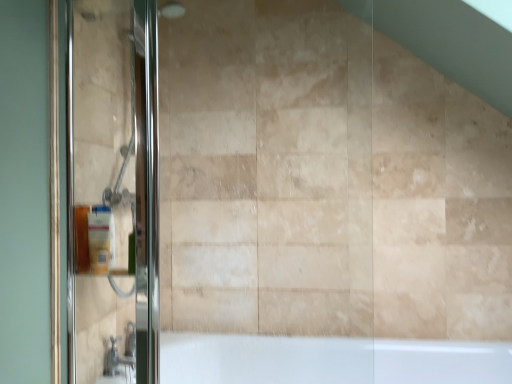
Identify the location of matte silver faucet at lower left. The image size is (512, 384). (119, 356).

The image size is (512, 384). Describe the element at coordinates (113, 180) in the screenshot. I see `polished glass shower door at left` at that location.

The width and height of the screenshot is (512, 384). What are the coordinates of `matte silver faucet at lower left` in the screenshot? It's located at (119, 356).

Is polished glass shower door at left facing away from matte silver faucet at lower left?

Correct, polished glass shower door at left is looking away from matte silver faucet at lower left.

From the image's perspective, is polished glass shower door at left over matte silver faucet at lower left?

Indeed, from the image's perspective, polished glass shower door at left is shown above matte silver faucet at lower left.

Is point (72, 327) positioned before point (130, 356)?

That is True.

Locate an element on the screen. This screenshot has height=384, width=512. faucet behind the polished glass shower door at left is located at coordinates (119, 356).

You are a GUI agent. You are given a task and a screenshot of the screen. Output one action in this format:
    pyautogui.click(x=<x>, y=<y>)
    Task: Click on the faucet that appears below the polished glass shower door at left (from the image's perspective)
    
    Given the screenshot: What is the action you would take?
    pyautogui.click(x=119, y=356)

Is matte silver faucet at lower left situated inside polished glass shower door at left or outside?

matte silver faucet at lower left is outside polished glass shower door at left.

Is matte silver faucet at lower left smaller than polished glass shower door at left?

Yes, matte silver faucet at lower left is smaller than polished glass shower door at left.

Considering the positions of objects matte silver faucet at lower left and matte plastic soap dispenser at left in the image provided, who is behind, matte silver faucet at lower left or matte plastic soap dispenser at left?

Positioned behind is matte silver faucet at lower left.

How different are the orientations of matte silver faucet at lower left and matte plastic soap dispenser at left in degrees?

matte silver faucet at lower left and matte plastic soap dispenser at left are facing 83.4 degrees away from each other.

Would you say matte silver faucet at lower left is outside matte plastic soap dispenser at left?

Yes.

Which of these two, polished glass shower door at left or matte plastic soap dispenser at left, is thinner?

matte plastic soap dispenser at left is thinner.

Would you say polished glass shower door at left is a long distance from matte plastic soap dispenser at left?

Actually, polished glass shower door at left and matte plastic soap dispenser at left are a little close together.

From a real-world perspective, is polished glass shower door at left on matte plastic soap dispenser at left?

Correct, in the physical world, polished glass shower door at left is higher than matte plastic soap dispenser at left.

Which of these two, polished glass shower door at left or matte plastic soap dispenser at left, is bigger?

polished glass shower door at left.

From the image's perspective, which is above, matte plastic soap dispenser at left or matte silver faucet at lower left?

From the image's view, matte plastic soap dispenser at left is above.

Is matte plastic soap dispenser at left turned away from matte silver faucet at lower left?

matte plastic soap dispenser at left does not have its back to matte silver faucet at lower left.

Is point (113, 230) positioned before point (114, 367)?

No, it is behind (114, 367).

Which object is further away from the camera taking this photo, matte plastic soap dispenser at left or polished glass shower door at left?

matte plastic soap dispenser at left.

Identify the location of screen door above the matte plastic soap dispenser at left (from a real-world perspective). (113, 180).

Is matte plastic soap dispenser at left at the left side of polished glass shower door at left?

Yes, matte plastic soap dispenser at left is to the left of polished glass shower door at left.

From the image's perspective, is matte plastic soap dispenser at left positioned above or below polished glass shower door at left?

matte plastic soap dispenser at left is below polished glass shower door at left.

What are the coordinates of `faucet below the polished glass shower door at left (from a real-world perspective)` in the screenshot? It's located at (119, 356).

Identify the location of screen door in front of the matte silver faucet at lower left. This screenshot has height=384, width=512. (113, 180).

In the scene shown: From the image, which object appears to be nearer to matte plastic soap dispenser at left, polished glass shower door at left or matte silver faucet at lower left?

The object closer to matte plastic soap dispenser at left is polished glass shower door at left.

From the image, which object appears to be farther from matte plastic soap dispenser at left, matte silver faucet at lower left or polished glass shower door at left?

Among the two, matte silver faucet at lower left is located further to matte plastic soap dispenser at left.

From the image, which object appears to be nearer to matte silver faucet at lower left, polished glass shower door at left or matte plastic soap dispenser at left?

matte plastic soap dispenser at left is positioned closer to the anchor matte silver faucet at lower left.

From the image, which object appears to be farther from matte silver faucet at lower left, matte plastic soap dispenser at left or polished glass shower door at left?

polished glass shower door at left is positioned further to the anchor matte silver faucet at lower left.

Estimate the real-world distances between objects in this image. Which object is further from polished glass shower door at left, matte plastic soap dispenser at left or matte silver faucet at lower left?

Based on the image, matte silver faucet at lower left appears to be further to polished glass shower door at left.

Considering their positions, is matte silver faucet at lower left positioned further to polished glass shower door at left than matte plastic soap dispenser at left?

Among the two, matte silver faucet at lower left is located further to polished glass shower door at left.

The width and height of the screenshot is (512, 384). I want to click on toiletry that lies between polished glass shower door at left and matte silver faucet at lower left from top to bottom, so click(x=101, y=239).